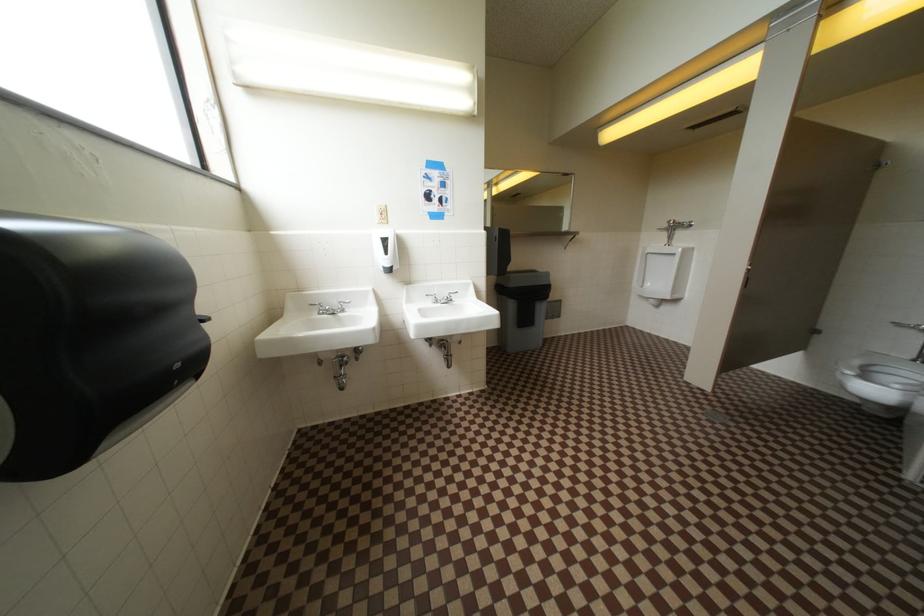
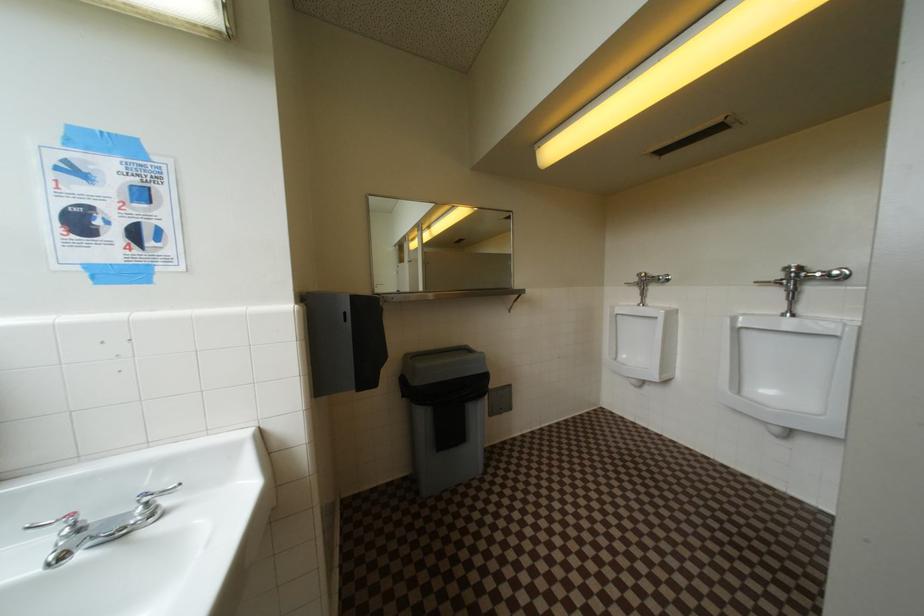
What movement of the cameraman would produce the second image?

The movement direction of the cameraman is right, forward.